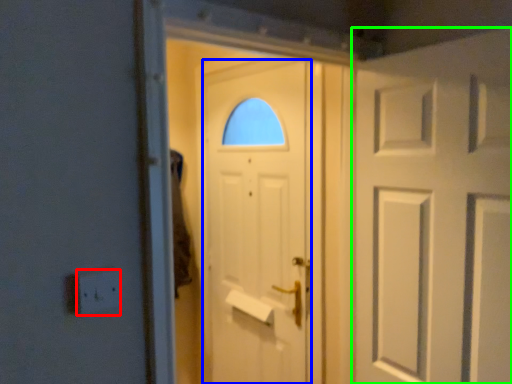
Question: Which object is positioned closest to electric outlet (highlighted by a red box)? Select from door (highlighted by a blue box) and door (highlighted by a green box).

Choices:
 (A) door
 (B) door

Answer: (B)